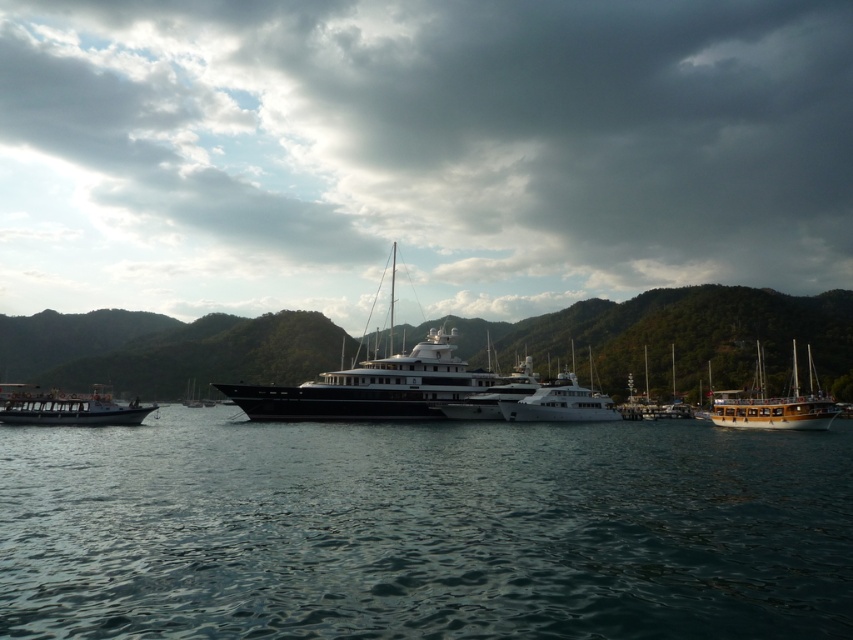
You are an astronomer trying to determine the coordinates of the cloudy sky at upper center in the image. What are its coordinates?

The cloudy sky at upper center is located at coordinates (x=418, y=150).